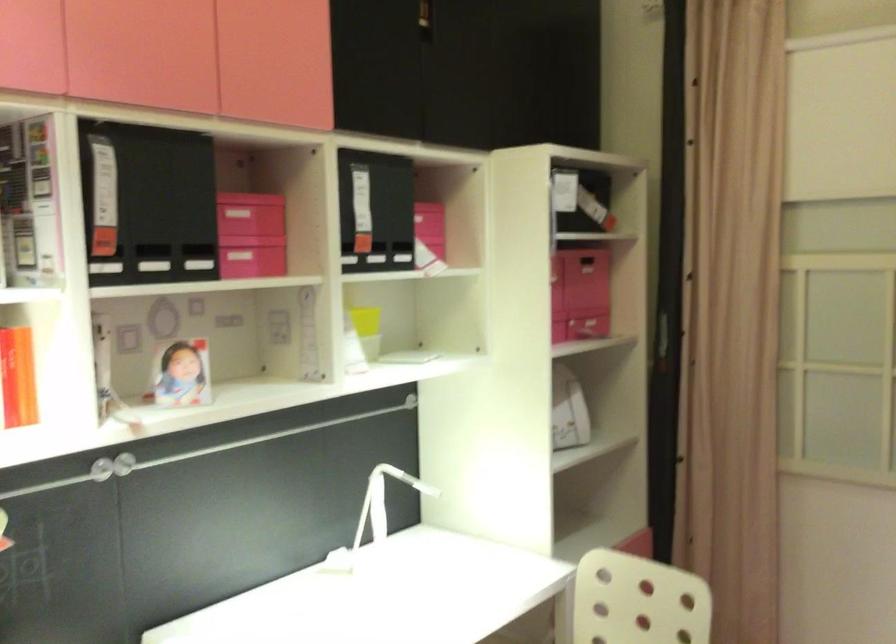
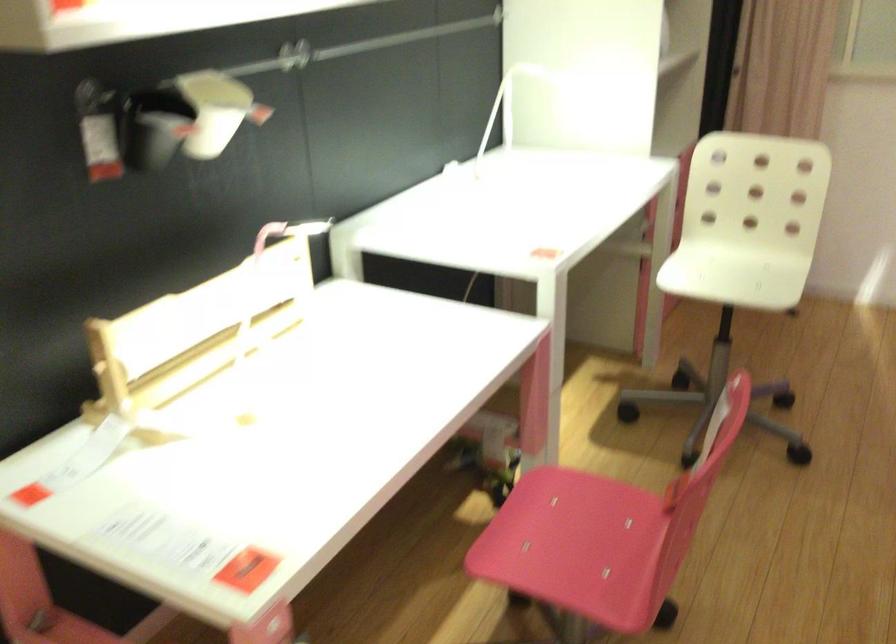
Question: Which direction would the cameraman need to move to produce the second image? Reply with the corresponding letter.

Choices:
 (A) Left
 (B) Right
 (C) Forward
 (D) Backward

Answer: (A)